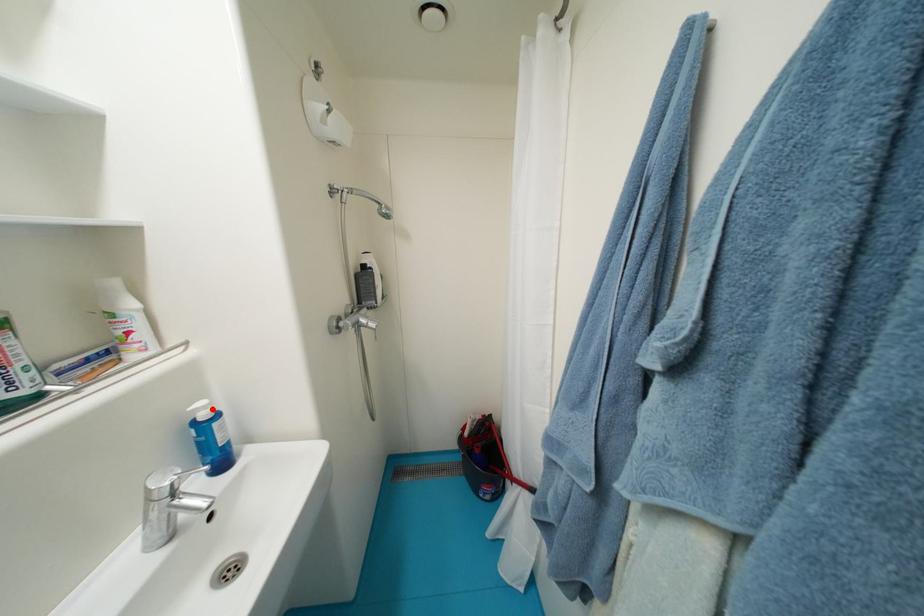
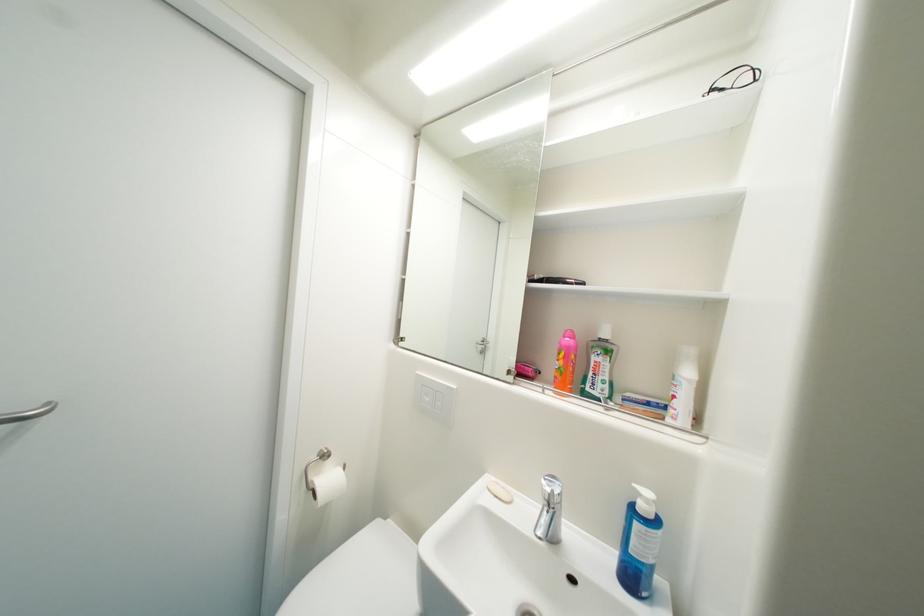
Where in the second image is the point corresponding to the highlighted location from the first image?

(653, 503)